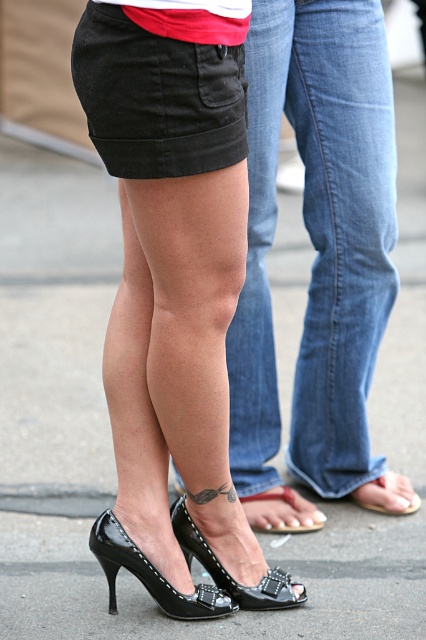
Does black denim skirt at upper center appear over black patent leather sandal at lower right?

Yes.

Does black denim skirt at upper center appear on the right side of black patent leather sandal at lower right?

In fact, black denim skirt at upper center is to the left of black patent leather sandal at lower right.

What do you see at coordinates (158, 97) in the screenshot? The width and height of the screenshot is (426, 640). I see `black denim skirt at upper center` at bounding box center [158, 97].

I want to click on black denim skirt at upper center, so click(x=158, y=97).

Describe the element at coordinates (316, 241) in the screenshot. I see `denim jeans at center` at that location.

What do you see at coordinates (316, 241) in the screenshot? I see `denim jeans at center` at bounding box center [316, 241].

Identify the location of denim jeans at center. Image resolution: width=426 pixels, height=640 pixels. (316, 241).

Who is positioned more to the left, shiny patent leather heels at lower center or black patent leather sandal at lower center?

From the viewer's perspective, shiny patent leather heels at lower center appears more on the left side.

Is point (195, 444) more distant than point (316, 520)?

No, it is in front of (316, 520).

Find the location of a particular element. This screenshot has width=426, height=640. shiny patent leather heels at lower center is located at coordinates (175, 289).